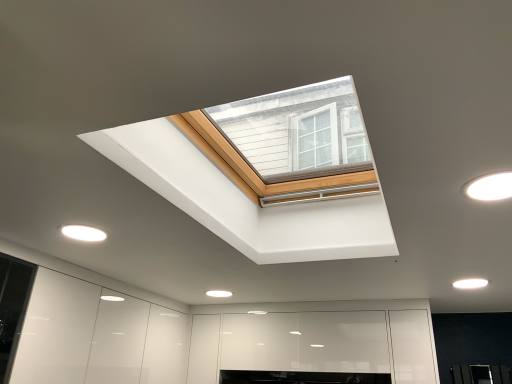
Question: Is white matte light fixture at upper right, which ranks as the 3th lighting in bottom-to-top order, positioned behind white matte light fixture at lower right, arranged as the third lighting when viewed from the left?

Choices:
 (A) yes
 (B) no

Answer: (B)

Question: Can you confirm if white matte light fixture at upper right, which appears as the 3th lighting when viewed from the back, is bigger than white matte light fixture at lower right, the 1th lighting when ordered from back to front?

Choices:
 (A) yes
 (B) no

Answer: (A)

Question: Could you tell me if white matte light fixture at upper right, positioned as the second lighting in right-to-left order, is facing white matte light fixture at lower right, the first lighting in the bottom-to-top sequence?

Choices:
 (A) no
 (B) yes

Answer: (A)

Question: Is the position of white matte light fixture at upper right, positioned as the second lighting in right-to-left order, less distant than that of white matte light fixture at lower right, the 1th lighting when ordered from back to front?

Choices:
 (A) no
 (B) yes

Answer: (B)

Question: From the image's perspective, would you say white matte light fixture at upper right, which appears as the 3th lighting when viewed from the back, is positioned over white matte light fixture at lower right, which ranks as the third lighting in front-to-back order?

Choices:
 (A) no
 (B) yes

Answer: (B)

Question: From a real-world perspective, is white matte light fixture at lower right, arranged as the third lighting when viewed from the left, physically located above or below white glossy light fixture at lower left, marked as the 2th lighting in a back-to-front arrangement?

Choices:
 (A) below
 (B) above

Answer: (B)

Question: Relative to white glossy light fixture at lower left, placed as the second lighting when sorted from front to back, is white matte light fixture at lower right, the 1th lighting when ordered from back to front, in front or behind?

Choices:
 (A) behind
 (B) front

Answer: (A)

Question: Is white matte light fixture at lower right, the 1th lighting when ordered from back to front, bigger or smaller than white glossy light fixture at lower left, positioned as the 3th lighting in right-to-left order?

Choices:
 (A) small
 (B) big

Answer: (A)

Question: Considering the positions of white matte light fixture at lower right, which ranks as the third lighting in front-to-back order, and white glossy light fixture at lower left, marked as the 2th lighting in a back-to-front arrangement, in the image, is white matte light fixture at lower right, which ranks as the third lighting in front-to-back order, wider or thinner than white glossy light fixture at lower left, marked as the 2th lighting in a back-to-front arrangement,?

Choices:
 (A) wide
 (B) thin

Answer: (B)

Question: Is white glossy light fixture at lower left, positioned as the 3th lighting in right-to-left order, taller or shorter than white matte light fixture at lower right, which ranks as the third lighting in front-to-back order?

Choices:
 (A) short
 (B) tall

Answer: (A)

Question: Is point (84, 231) closer or farther from the camera than point (460, 279)?

Choices:
 (A) closer
 (B) farther

Answer: (A)

Question: Visually, is white glossy light fixture at lower left, arranged as the 2th lighting when ordered from the bottom, positioned to the left or to the right of white matte light fixture at lower right, the first lighting in the bottom-to-top sequence?

Choices:
 (A) left
 (B) right

Answer: (A)

Question: Considering their positions, is white glossy light fixture at lower left, placed as the second lighting when sorted from front to back, located in front of or behind white matte light fixture at lower right, arranged as the third lighting when viewed from the left?

Choices:
 (A) behind
 (B) front

Answer: (B)

Question: From the image's perspective, is white matte light fixture at upper right, positioned as the second lighting in right-to-left order, above or below white matte light fixture at lower right, arranged as the third lighting when viewed from the left?

Choices:
 (A) above
 (B) below

Answer: (A)

Question: Is point (492, 175) closer or farther from the camera than point (468, 283)?

Choices:
 (A) closer
 (B) farther

Answer: (A)